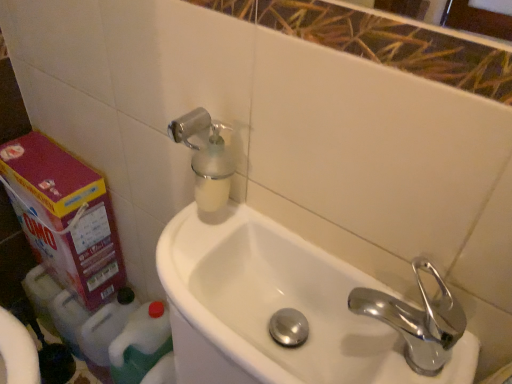
Question: From the image's perspective, is white glossy sink at center located above or below chrome metallic faucet at right?

Choices:
 (A) above
 (B) below

Answer: (B)

Question: From a real-world perspective, is white glossy sink at center positioned above or below chrome metallic faucet at right?

Choices:
 (A) below
 (B) above

Answer: (A)

Question: Estimate the real-world distances between objects in this image. Which object is closer to the white plastic bottle at lower left?

Choices:
 (A) pink cardboard carton at left
 (B) chrome metallic faucet at right
 (C) white glossy sink at center
 (D) translucent plastic soap dispenser at upper left

Answer: (A)

Question: Which object is the farthest from the white glossy sink at center?

Choices:
 (A) chrome metallic faucet at right
 (B) white plastic bottle at lower left
 (C) pink cardboard carton at left
 (D) translucent plastic soap dispenser at upper left

Answer: (B)